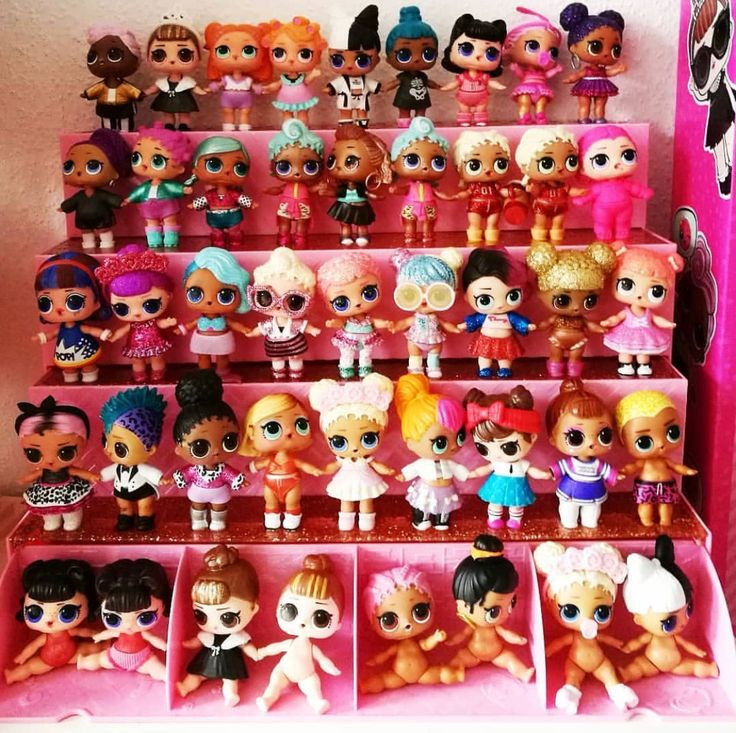
The width and height of the screenshot is (736, 733). In order to click on dolls on bottom row in this screenshot , I will do `click(657, 622)`, `click(586, 605)`, `click(484, 597)`, `click(411, 611)`, `click(290, 615)`, `click(233, 608)`, `click(137, 605)`, `click(43, 594)`.